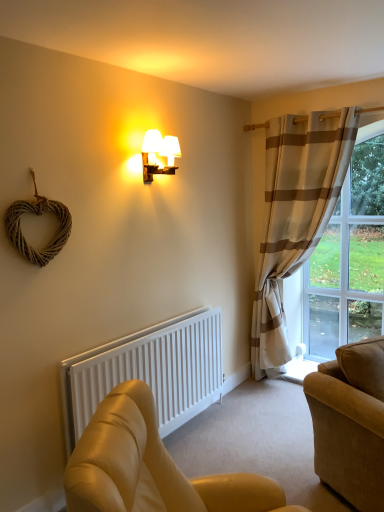
This screenshot has width=384, height=512. I want to click on clear glass window at right, so click(x=349, y=258).

What do you see at coordinates (349, 258) in the screenshot?
I see `clear glass window at right` at bounding box center [349, 258].

How much space does suede-like beige couch at lower right, acting as the first studio couch starting from the back, occupy horizontally?

23.60 inches.

Measure the distance between matte gold wall sconce at upper center and camera.

matte gold wall sconce at upper center and camera are 2.63 meters apart.

What do you see at coordinates (151, 467) in the screenshot? This screenshot has width=384, height=512. I see `leather couch at lower right, positioned as the 2th studio couch in back-to-front order` at bounding box center [151, 467].

The image size is (384, 512). What do you see at coordinates (149, 371) in the screenshot? I see `white matte radiator at lower left` at bounding box center [149, 371].

At what (x,y) coordinates should I click in order to perform the action: click on clear glass window at right. Please return your answer as a coordinate pair (x, y). The width and height of the screenshot is (384, 512). Looking at the image, I should click on (349, 258).

Between point (153, 136) and point (97, 443), which one is positioned in front?

Positioned in front is point (97, 443).

From a real-world perspective, which object rests below the other?

leather couch at lower right, acting as the first studio couch starting from the front, is physically lower.

Which object is thinner, matte gold wall sconce at upper center or leather couch at lower right, acting as the first studio couch starting from the front?

matte gold wall sconce at upper center is thinner.

Where is `lamp behind the leather couch at lower right, positioned as the 2th studio couch in back-to-front order`? This screenshot has width=384, height=512. lamp behind the leather couch at lower right, positioned as the 2th studio couch in back-to-front order is located at coordinates (158, 153).

Locate an element on the screen. The width and height of the screenshot is (384, 512). window above the beige striped curtain at right (from the image's perspective) is located at coordinates (349, 258).

Is clear glass window at right located within beige striped curtain at right?

No, clear glass window at right is not a part of beige striped curtain at right.

Does beige striped curtain at right have a greater width compared to clear glass window at right?

Yes.

Who is smaller, beige striped curtain at right or clear glass window at right?

With smaller size is clear glass window at right.

Is suede-like beige couch at lower right, acting as the first studio couch starting from the back, at the right side of white matte radiator at lower left?

Yes, suede-like beige couch at lower right, acting as the first studio couch starting from the back, is to the right of white matte radiator at lower left.

From the image's perspective, between suede-like beige couch at lower right, the 2th studio couch from the front, and white matte radiator at lower left, which one is located above?

white matte radiator at lower left, from the image's perspective.

Are suede-like beige couch at lower right, acting as the first studio couch starting from the back, and white matte radiator at lower left making contact?

There is a gap between suede-like beige couch at lower right, acting as the first studio couch starting from the back, and white matte radiator at lower left.

Is suede-like beige couch at lower right, the 2th studio couch from the front, not within white matte radiator at lower left?

Yes, suede-like beige couch at lower right, the 2th studio couch from the front, is not within white matte radiator at lower left.

From a real-world perspective, between white matte radiator at lower left and suede-like beige couch at lower right, the 2th studio couch from the front, who is vertically higher?

From a 3D spatial view, suede-like beige couch at lower right, the 2th studio couch from the front, is above.

Would you say white matte radiator at lower left is to the left or to the right of suede-like beige couch at lower right, acting as the first studio couch starting from the back, in the picture?

white matte radiator at lower left is to the left of suede-like beige couch at lower right, acting as the first studio couch starting from the back.

Between point (90, 416) and point (369, 505), which one is positioned in front?

The point (369, 505) is more forward.

Which of these two, white matte radiator at lower left or suede-like beige couch at lower right, the 2th studio couch from the front, is wider?

suede-like beige couch at lower right, the 2th studio couch from the front, is wider.

Considering the relative sizes of beige striped curtain at right and matte gold wall sconce at upper center in the image provided, is beige striped curtain at right bigger than matte gold wall sconce at upper center?

Indeed, beige striped curtain at right has a larger size compared to matte gold wall sconce at upper center.

Is beige striped curtain at right taller than matte gold wall sconce at upper center?

Indeed, beige striped curtain at right has a greater height compared to matte gold wall sconce at upper center.

Is point (313, 112) closer or farther from the camera than point (149, 179)?

Point (313, 112) is positioned farther from the camera compared to point (149, 179).

From the image's perspective, is matte gold wall sconce at upper center positioned above or below white matte radiator at lower left?

Clearly, from the image's perspective, matte gold wall sconce at upper center is above white matte radiator at lower left.

Considering the relative sizes of matte gold wall sconce at upper center and white matte radiator at lower left in the image provided, is matte gold wall sconce at upper center taller than white matte radiator at lower left?

No.

From a real-world perspective, which is physically above, matte gold wall sconce at upper center or white matte radiator at lower left?

From a 3D spatial view, matte gold wall sconce at upper center is above.

Can you confirm if clear glass window at right is wider than matte gold wall sconce at upper center?

No.

Can matte gold wall sconce at upper center be found inside clear glass window at right?

No, clear glass window at right does not contain matte gold wall sconce at upper center.

From a real-world perspective, relative to matte gold wall sconce at upper center, is clear glass window at right vertically above or below?

From a real-world perspective, clear glass window at right is physically below matte gold wall sconce at upper center.

This screenshot has width=384, height=512. Identify the location of the 2nd studio couch directly beneath the matte gold wall sconce at upper center (from a real-world perspective). (151, 467).

What are the coordinates of `window above the beige striped curtain at right (from the image's perspective)` in the screenshot? It's located at (349, 258).

Considering their positions, is clear glass window at right positioned further to beige striped curtain at right than white matte radiator at lower left?

The object further to beige striped curtain at right is white matte radiator at lower left.

When comparing their distances from suede-like beige couch at lower right, the 2th studio couch from the front, does white matte radiator at lower left or matte gold wall sconce at upper center seem closer?

white matte radiator at lower left lies closer to suede-like beige couch at lower right, the 2th studio couch from the front, than the other object.

From the image, which object appears to be farther from matte gold wall sconce at upper center, beige striped curtain at right or leather couch at lower right, acting as the first studio couch starting from the front?

The object further to matte gold wall sconce at upper center is leather couch at lower right, acting as the first studio couch starting from the front.

Estimate the real-world distances between objects in this image. Which object is further from clear glass window at right, suede-like beige couch at lower right, acting as the first studio couch starting from the back, or matte gold wall sconce at upper center?

Among the two, matte gold wall sconce at upper center is located further to clear glass window at right.

From the image, which object appears to be farther from beige striped curtain at right, leather couch at lower right, acting as the first studio couch starting from the front, or suede-like beige couch at lower right, acting as the first studio couch starting from the back?

leather couch at lower right, acting as the first studio couch starting from the front, is positioned further to the anchor beige striped curtain at right.

In the scene shown: From the image, which object appears to be nearer to leather couch at lower right, positioned as the 2th studio couch in back-to-front order, matte gold wall sconce at upper center or clear glass window at right?

Based on the image, matte gold wall sconce at upper center appears to be nearer to leather couch at lower right, positioned as the 2th studio couch in back-to-front order.

When comparing their distances from white matte radiator at lower left, does suede-like beige couch at lower right, acting as the first studio couch starting from the back, or clear glass window at right seem further?

clear glass window at right is positioned further to the anchor white matte radiator at lower left.

Looking at the image, which one is located closer to beige striped curtain at right, clear glass window at right or leather couch at lower right, acting as the first studio couch starting from the front?

clear glass window at right is closer to beige striped curtain at right.

Where is `curtain between matte gold wall sconce at upper center and suede-like beige couch at lower right, acting as the first studio couch starting from the back, from top to bottom`? curtain between matte gold wall sconce at upper center and suede-like beige couch at lower right, acting as the first studio couch starting from the back, from top to bottom is located at coordinates 295,215.

Where is `radiator between matte gold wall sconce at upper center and clear glass window at right`? radiator between matte gold wall sconce at upper center and clear glass window at right is located at coordinates (149, 371).

Where is `radiator between leather couch at lower right, acting as the first studio couch starting from the front, and clear glass window at right from front to back`? The height and width of the screenshot is (512, 384). radiator between leather couch at lower right, acting as the first studio couch starting from the front, and clear glass window at right from front to back is located at coordinates (149, 371).

Image resolution: width=384 pixels, height=512 pixels. Identify the location of curtain between matte gold wall sconce at upper center and leather couch at lower right, positioned as the 2th studio couch in back-to-front order, in the up-down direction. (295, 215).